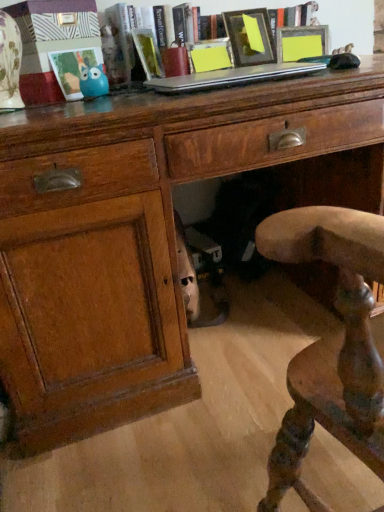
Where is `vacant space to the left of blue rubber toy at upper left`? This screenshot has height=512, width=384. vacant space to the left of blue rubber toy at upper left is located at coordinates (50, 105).